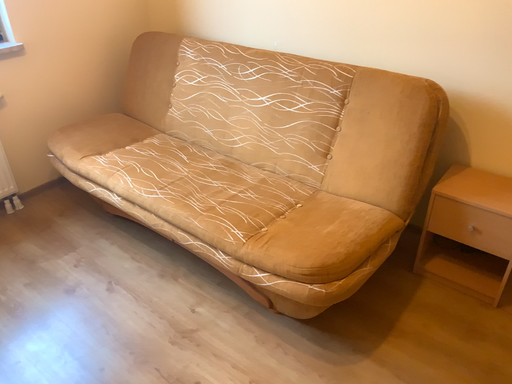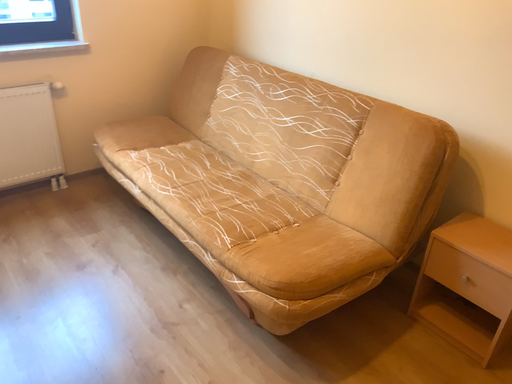
Question: Which way did the camera rotate in the video?

Choices:
 (A) rotated right
 (B) rotated left

Answer: (B)